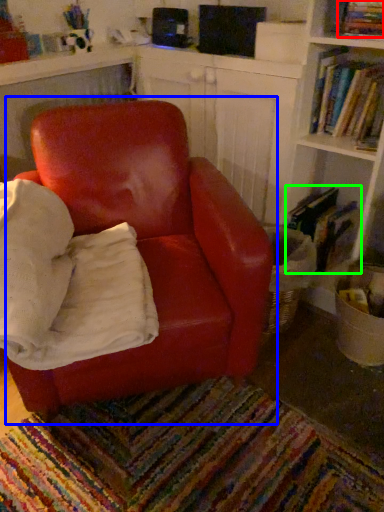
Question: Considering the real-world distances, which object is farthest from book (highlighted by a red box)? chair (highlighted by a blue box) or book (highlighted by a green box)?

Choices:
 (A) chair
 (B) book

Answer: (A)